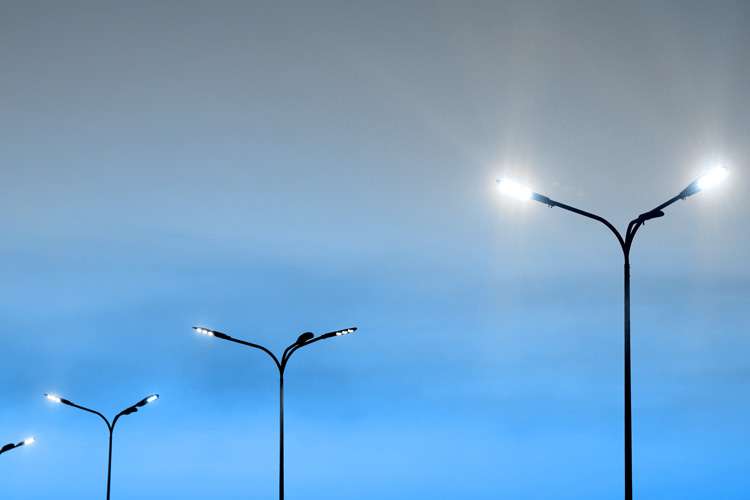
Identify the location of light. This screenshot has height=500, width=750. (349, 329).